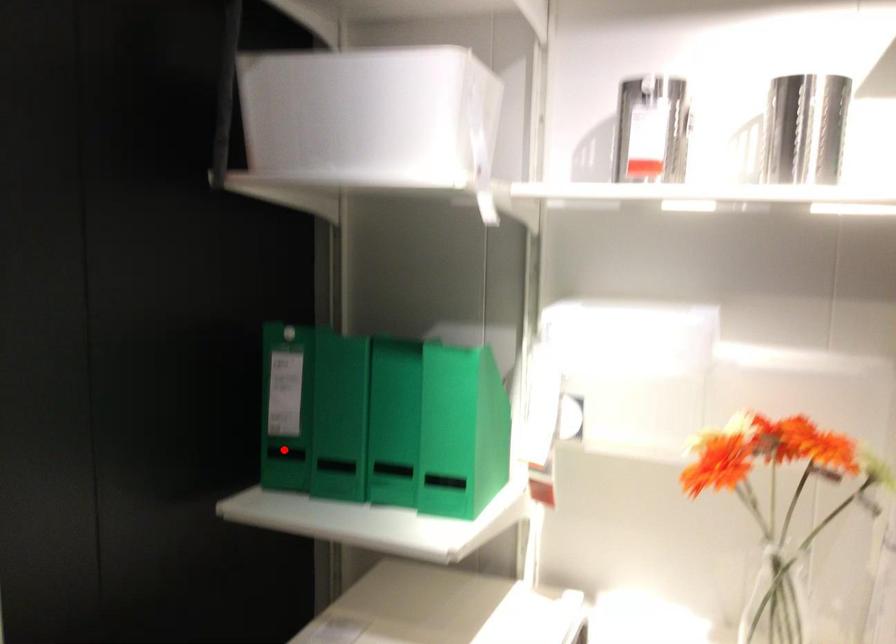
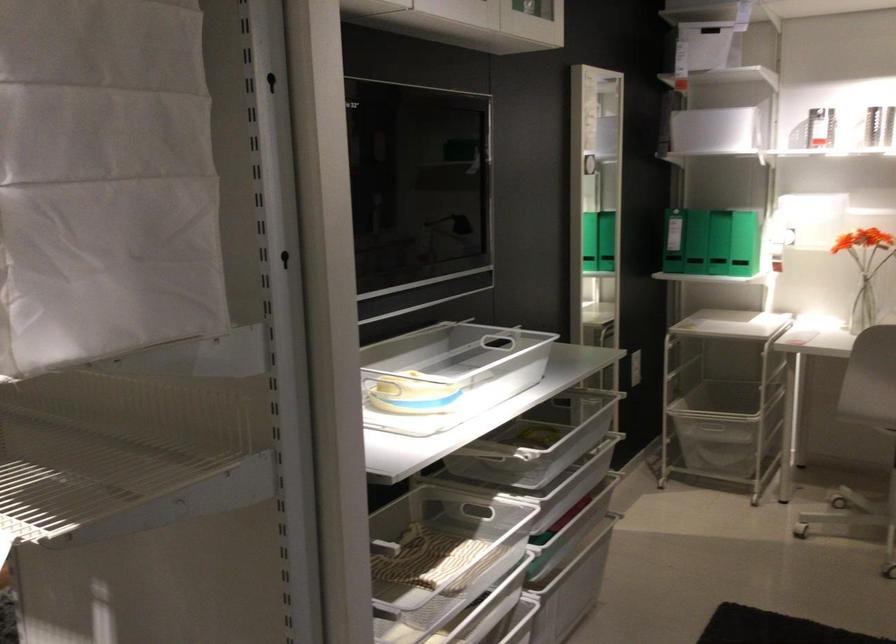
The point at the highlighted location is marked in the first image. Where is the corresponding point in the second image?

(695, 242)